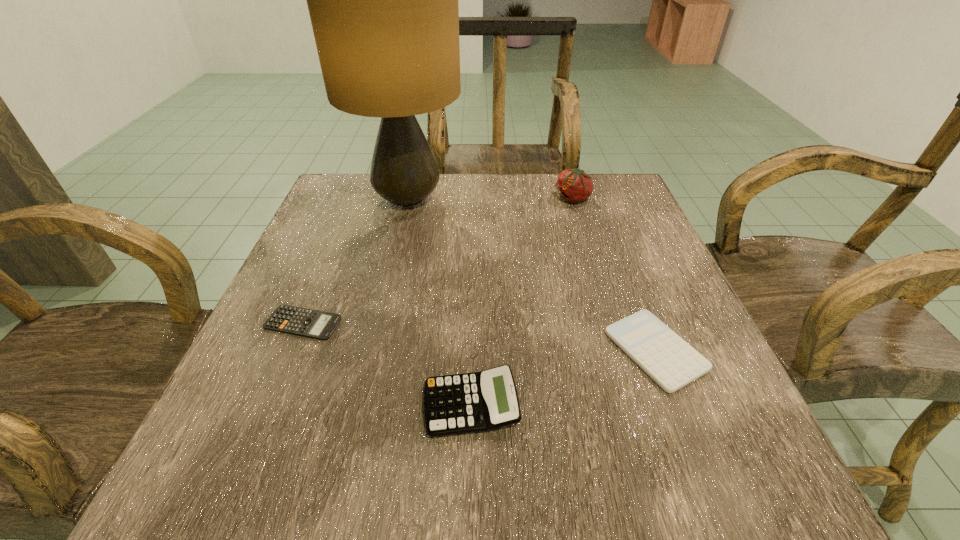
Where is `blank region between the fourth tallest object and the third tallest object`? The width and height of the screenshot is (960, 540). blank region between the fourth tallest object and the third tallest object is located at coordinates (564, 378).

At what (x,y) coordinates should I click in order to perform the action: click on empty space between the lampshade and the tallest calculator. Please return your answer as a coordinate pair (x, y). This screenshot has height=540, width=960. Looking at the image, I should click on (440, 303).

Where is `vacant area that lies between the second shortest calculator and the shortest object`? vacant area that lies between the second shortest calculator and the shortest object is located at coordinates (479, 337).

I want to click on free point between the third shortest object and the rightmost calculator, so click(564, 378).

You are a GUI agent. You are given a task and a screenshot of the screen. Output one action in this format:
    pyautogui.click(x=<x>, y=<y>)
    Task: Click on the free space between the leftmost calculator and the second tallest object
    This screenshot has width=960, height=540.
    Given the screenshot: What is the action you would take?
    pyautogui.click(x=438, y=261)

Where is `empty location between the second shortest calculator and the fourth shortest object`? This screenshot has width=960, height=540. empty location between the second shortest calculator and the fourth shortest object is located at coordinates (614, 274).

Find the location of `vacant region between the tallest calculator and the second shortest object`. vacant region between the tallest calculator and the second shortest object is located at coordinates (564, 378).

This screenshot has width=960, height=540. Find the location of `free area in between the third shortest object and the rightmost calculator`. free area in between the third shortest object and the rightmost calculator is located at coordinates (564, 378).

You are a GUI agent. You are given a task and a screenshot of the screen. Output one action in this format:
    pyautogui.click(x=<x>, y=<y>)
    Task: Click on the vacant space in between the third shortest object and the second tallest object
    
    Given the screenshot: What is the action you would take?
    pyautogui.click(x=522, y=302)

Identify which object is the nearest to the lampshade. Please provide its 2D coordinates. Your answer should be formatted as a tuple, i.e. [(x, y)], where the tuple contains the x and y coordinates of a point satisfying the conditions above.

[(574, 185)]